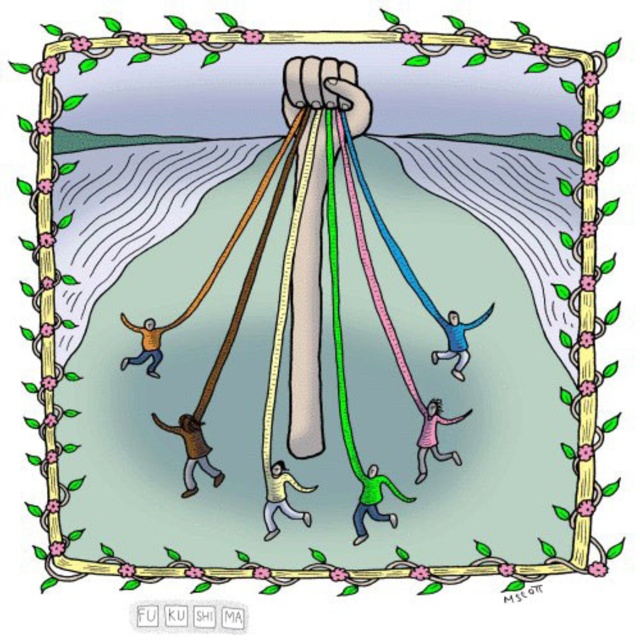
Measure the distance between blue fabric at center and camera.

blue fabric at center is 1.28 meters from camera.

Where is `blue fabric at center`? The height and width of the screenshot is (640, 640). blue fabric at center is located at coordinates (458, 339).

Is point (461, 340) positioned before point (157, 364)?

No, it is behind (157, 364).

Locate an element on the screen. This screenshot has width=640, height=640. blue fabric at center is located at coordinates (458, 339).

Between brown matte pants at lower left and blue fabric at center, which one is positioned lower?

brown matte pants at lower left is lower down.

In the scene shown: Is brown matte pants at lower left further to camera compared to blue fabric at center?

No, brown matte pants at lower left is closer to the viewer.

Does point (198, 467) come farther from viewer compared to point (460, 339)?

No, (198, 467) is in front of (460, 339).

Where is `brown matte pants at lower left`? The width and height of the screenshot is (640, 640). brown matte pants at lower left is located at coordinates (x=192, y=451).

From the picture: Between green matte person at center and blue fabric at center, which one is positioned higher?

blue fabric at center is above.

Is green matte person at center shorter than blue fabric at center?

Yes.

Locate an element on the screen. This screenshot has width=640, height=640. green matte person at center is located at coordinates (372, 502).